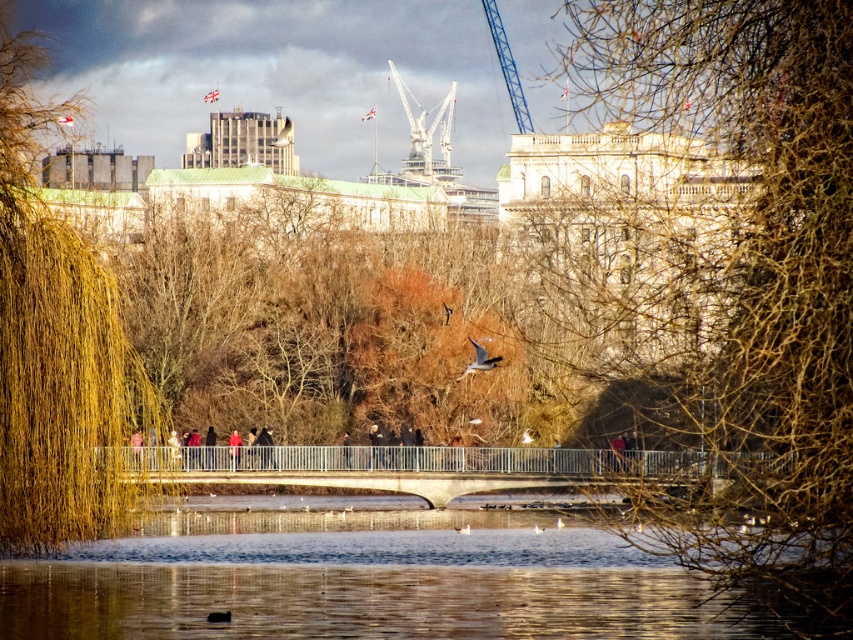
Is brown textured tree at center right shorter than transparent ice at center?

Incorrect, brown textured tree at center right's height does not fall short of transparent ice at center's.

Which is above, brown textured tree at center right or transparent ice at center?

brown textured tree at center right is above.

Is point (775, 344) in front of point (115, 604)?

Yes.

Where is `brown textured tree at center right`? Image resolution: width=853 pixels, height=640 pixels. brown textured tree at center right is located at coordinates (711, 266).

Does transparent ice at center have a greater width compared to red jacket at center?

Yes.

Is transparent ice at center positioned before red jacket at center?

That is True.

Is point (86, 556) farther from camera compared to point (238, 440)?

No.

I want to click on transparent ice at center, so (x=363, y=579).

Can you confirm if brown textured tree at center right is taller than white metallic crane at upper center?

Correct, brown textured tree at center right is much taller as white metallic crane at upper center.

Which of these two, brown textured tree at center right or white metallic crane at upper center, stands taller?

brown textured tree at center right

Is point (724, 74) closer to camera compared to point (407, 172)?

Yes, point (724, 74) is closer to viewer.

Locate an element on the screen. This screenshot has width=853, height=640. brown textured tree at center right is located at coordinates (711, 266).